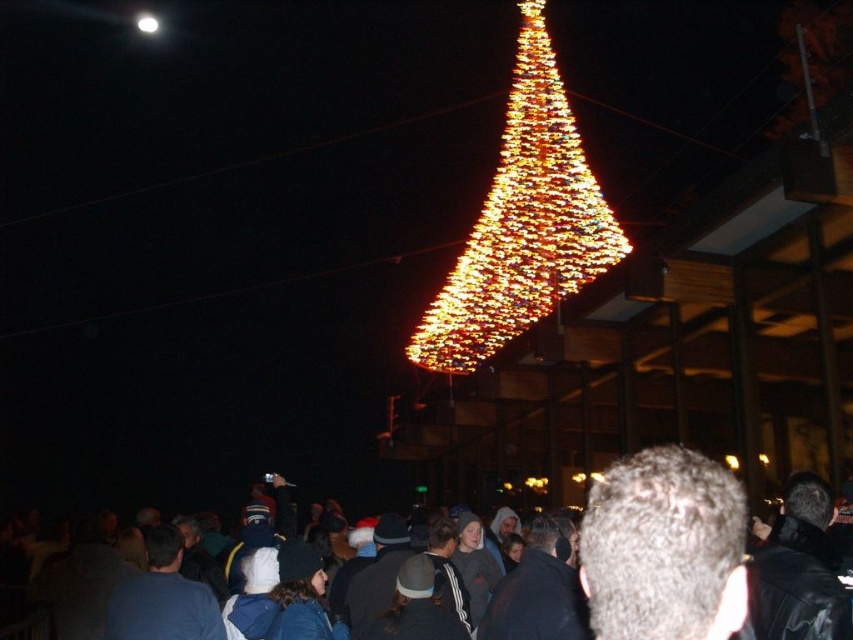
Question: Based on their relative distances, which object is nearer to the dark clothing crowd at center?

Choices:
 (A) white glossy light at upper left
 (B) gray hair at center

Answer: (B)

Question: Does dark clothing crowd at center have a larger size compared to white glossy light at upper left?

Choices:
 (A) yes
 (B) no

Answer: (A)

Question: Which object is closer to the camera taking this photo?

Choices:
 (A) dark clothing crowd at center
 (B) gray hair at center
 (C) white glossy light at upper left

Answer: (B)

Question: Is dark clothing crowd at center closer to camera compared to gray hair at center?

Choices:
 (A) yes
 (B) no

Answer: (B)

Question: Is dark clothing crowd at center bigger than illuminated plastic christmas tree at center?

Choices:
 (A) no
 (B) yes

Answer: (B)

Question: Based on their relative distances, which object is nearer to the white glossy light at upper left?

Choices:
 (A) gray hair at center
 (B) illuminated plastic christmas tree at center

Answer: (B)